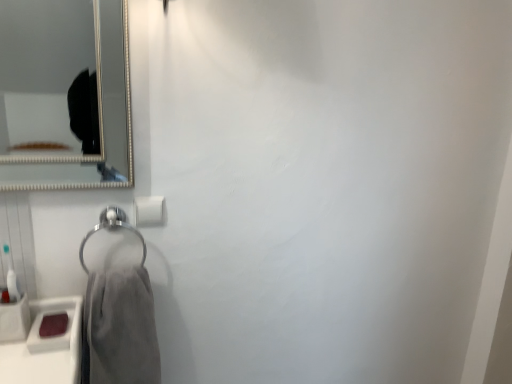
Question: Can you confirm if gray cotton towel at lower left is positioned to the left of matte pink soap at lower left?

Choices:
 (A) yes
 (B) no

Answer: (B)

Question: Can you confirm if gray cotton towel at lower left is thinner than matte pink soap at lower left?

Choices:
 (A) no
 (B) yes

Answer: (A)

Question: From a real-world perspective, does gray cotton towel at lower left sit lower than matte pink soap at lower left?

Choices:
 (A) no
 (B) yes

Answer: (B)

Question: Considering the relative sizes of gray cotton towel at lower left and matte pink soap at lower left in the image provided, is gray cotton towel at lower left bigger than matte pink soap at lower left?

Choices:
 (A) yes
 (B) no

Answer: (A)

Question: Is gray cotton towel at lower left positioned behind matte pink soap at lower left?

Choices:
 (A) yes
 (B) no

Answer: (B)

Question: Is white matte toilet paper at center in front of or behind matte pink soap at lower left in the image?

Choices:
 (A) behind
 (B) front

Answer: (A)

Question: Is white matte toilet paper at center wider or thinner than matte pink soap at lower left?

Choices:
 (A) wide
 (B) thin

Answer: (B)

Question: From the image's perspective, is white matte toilet paper at center located above or below matte pink soap at lower left?

Choices:
 (A) above
 (B) below

Answer: (A)

Question: Considering the positions of white matte toilet paper at center and matte pink soap at lower left in the image, is white matte toilet paper at center taller or shorter than matte pink soap at lower left?

Choices:
 (A) short
 (B) tall

Answer: (B)

Question: From the image's perspective, is matte pink soap at lower left positioned above or below gray cotton towel at lower left?

Choices:
 (A) below
 (B) above

Answer: (B)

Question: Is matte pink soap at lower left in front of or behind gray cotton towel at lower left in the image?

Choices:
 (A) front
 (B) behind

Answer: (B)

Question: Considering the relative positions of matte pink soap at lower left and gray cotton towel at lower left in the image provided, is matte pink soap at lower left to the left or to the right of gray cotton towel at lower left?

Choices:
 (A) right
 (B) left

Answer: (B)

Question: Is point (52, 299) positioned closer to the camera than point (86, 324)?

Choices:
 (A) farther
 (B) closer

Answer: (A)

Question: Would you say gray cotton towel at lower left is inside or outside matte pink soap at lower left?

Choices:
 (A) inside
 (B) outside

Answer: (B)

Question: From a real-world perspective, is gray cotton towel at lower left positioned above or below matte pink soap at lower left?

Choices:
 (A) above
 (B) below

Answer: (B)